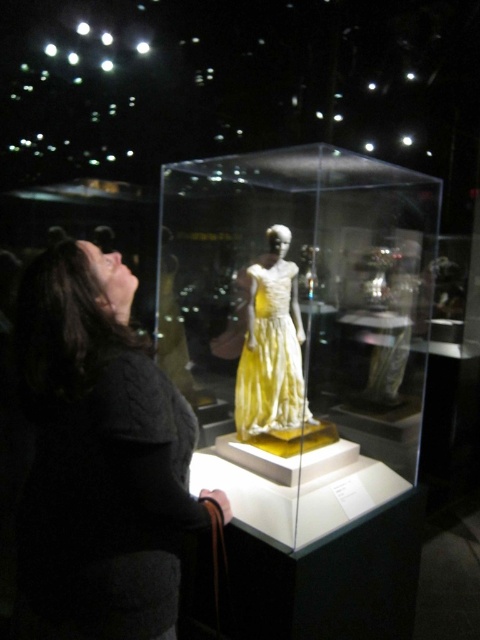
Consider the image. You are a security guard in the museum and need to ensure the yellow satin dress at center is fully visible through the transparent glass box at center. Based on their sizes, is the glass box tall enough to accommodate the dress?

The transparent glass box at center is taller than the yellow satin dress at center, so yes, the glass box is tall enough to accommodate the dress and ensure it is fully visible.

You are standing in the museum and want to take a photo of the transparent glass box at center. Where should you position yourself to ensure the box is fully visible in your camera frame?

Since the transparent glass box at center is located at point (299, 328), you should position yourself directly in front of it to capture the entire box within your camera frame.

You are an interior designer planning to place a new decorative item in the museum. The transparent glass box at center and the dark gray sweater at lower left are already present. Which object should you avoid placing a large sculpture near to prevent blocking the view of the display?

You should avoid placing the large sculpture near the transparent glass box at center because it is larger in size than the dark gray sweater at lower left and might obstruct the view of the display.